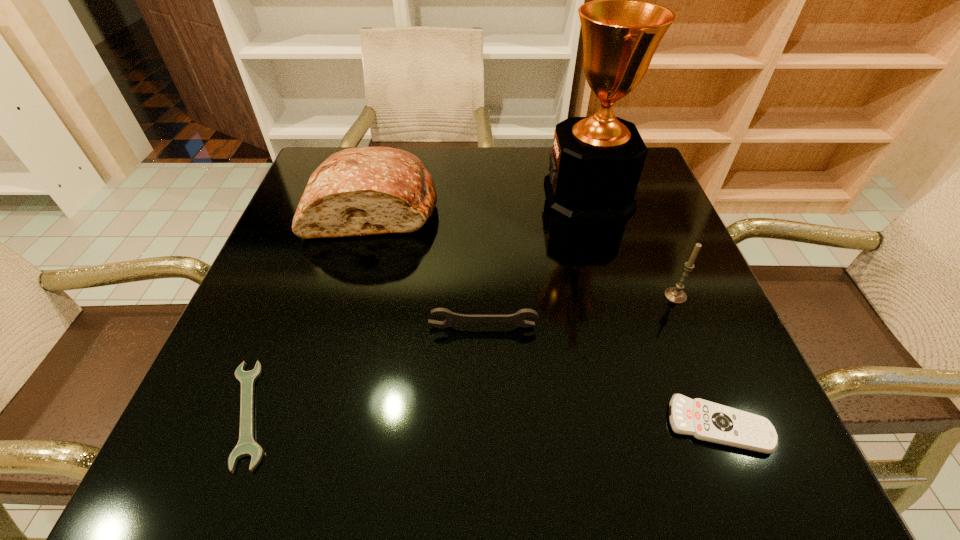
Find the location of `free spot between the tallest object and the bread`. free spot between the tallest object and the bread is located at coordinates (481, 200).

Locate an element on the screen. vacant space in between the third object from left to right and the third farthest object is located at coordinates (579, 312).

Find the location of a particular element. The image size is (960, 540). empty space between the fifth tallest object and the right wrench is located at coordinates (601, 376).

Identify which object is the third nearest to the trophy cup. Please provide its 2D coordinates. Your answer should be formatted as a tuple, i.e. [(x, y)], where the tuple contains the x and y coordinates of a point satisfying the conditions above.

[(359, 191)]

Find the location of `object that is the second closest one to the remote control`. object that is the second closest one to the remote control is located at coordinates (452, 318).

This screenshot has height=540, width=960. Identify the location of free space that satisfies the following two spatial constraints: 1. on the front of the tallest object with the label; 2. on the open ends of the third object from left to right. (626, 327).

Find the location of a particular element. blank space that satisfies the following two spatial constraints: 1. on the open ends of the fourth object from right to left; 2. on the right side of the remote control is located at coordinates (484, 425).

Identify the location of vacant region that satisfies the following two spatial constraints: 1. at the sliced front of the bread; 2. on the right side of the candle. (348, 296).

Identify the location of free space that satisfies the following two spatial constraints: 1. on the front of the tallest object with the label; 2. at the sliced front of the bread. The width and height of the screenshot is (960, 540). (591, 206).